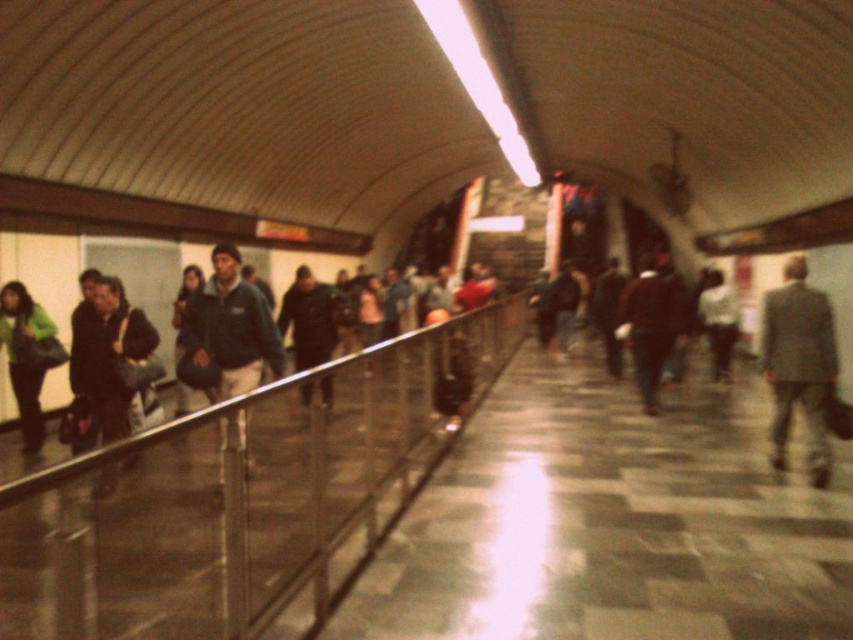
Question: Which object is closer to the camera taking this photo?

Choices:
 (A) metallic silver rail at left
 (B) matte blue jacket at center
 (C) gray suit at right
 (D) green fabric jacket at left

Answer: (A)

Question: Which object is positioned closest to the green fabric jacket at left?

Choices:
 (A) matte blue jacket at center
 (B) metallic silver rail at left

Answer: (A)

Question: Does gray suit at right come in front of green fabric jacket at left?

Choices:
 (A) no
 (B) yes

Answer: (B)

Question: Can you confirm if metallic silver rail at left is positioned below gray suit at right?

Choices:
 (A) no
 (B) yes

Answer: (B)

Question: Does metallic silver rail at left have a greater width compared to matte blue jacket at center?

Choices:
 (A) yes
 (B) no

Answer: (B)

Question: Based on their relative distances, which object is nearer to the green fabric jacket at left?

Choices:
 (A) gray suit at right
 (B) metallic silver rail at left

Answer: (B)